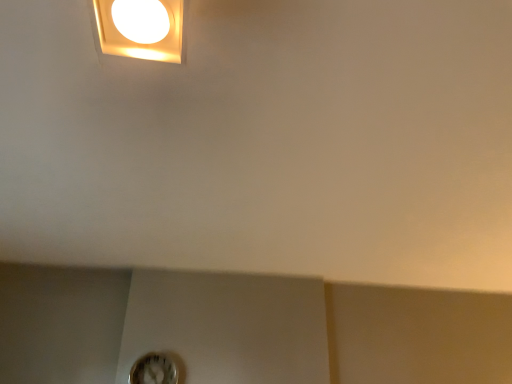
Question: Considering the relative sizes of white plastic light fixture at upper left and white plastic clock at lower center in the image provided, is white plastic light fixture at upper left smaller than white plastic clock at lower center?

Choices:
 (A) no
 (B) yes

Answer: (A)

Question: Is white plastic light fixture at upper left behind white plastic clock at lower center?

Choices:
 (A) no
 (B) yes

Answer: (A)

Question: Considering the relative sizes of white plastic light fixture at upper left and white plastic clock at lower center in the image provided, is white plastic light fixture at upper left shorter than white plastic clock at lower center?

Choices:
 (A) no
 (B) yes

Answer: (B)

Question: From the image's perspective, is white plastic light fixture at upper left on top of white plastic clock at lower center?

Choices:
 (A) no
 (B) yes

Answer: (B)

Question: Is white plastic clock at lower center at the back of white plastic light fixture at upper left?

Choices:
 (A) yes
 (B) no

Answer: (A)

Question: Does white plastic light fixture at upper left have a greater width compared to white plastic clock at lower center?

Choices:
 (A) yes
 (B) no

Answer: (A)

Question: Is white plastic clock at lower center thinner than white plastic light fixture at upper left?

Choices:
 (A) no
 (B) yes

Answer: (B)

Question: Is white plastic clock at lower center facing away from white plastic light fixture at upper left?

Choices:
 (A) yes
 (B) no

Answer: (B)

Question: Can you confirm if white plastic clock at lower center is taller than white plastic light fixture at upper left?

Choices:
 (A) yes
 (B) no

Answer: (A)

Question: Are white plastic clock at lower center and white plastic light fixture at upper left beside each other?

Choices:
 (A) no
 (B) yes

Answer: (A)

Question: Is white plastic clock at lower center completely or partially outside of white plastic light fixture at upper left?

Choices:
 (A) yes
 (B) no

Answer: (A)

Question: From the image's perspective, is white plastic clock at lower center on top of white plastic light fixture at upper left?

Choices:
 (A) yes
 (B) no

Answer: (B)

Question: Is white plastic clock at lower center wider or thinner than white plastic light fixture at upper left?

Choices:
 (A) thin
 (B) wide

Answer: (A)